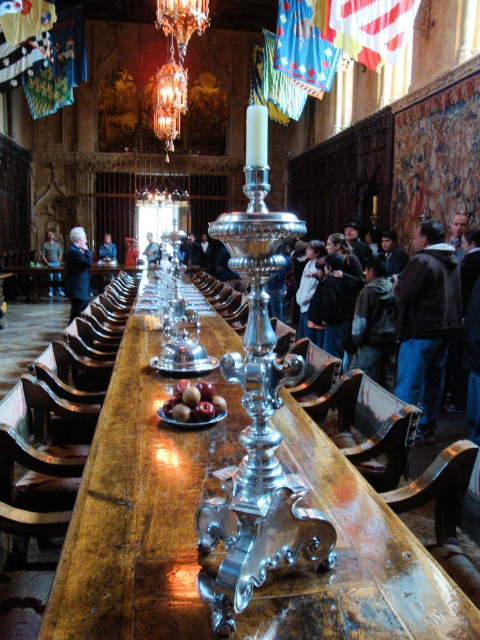
Question: Which object is closer to the camera taking this photo?

Choices:
 (A) brown leather jacket at right
 (B) dark brown leather jacket at center
 (C) orange fabric jacket at center
 (D) blue denim jacket at center

Answer: (A)

Question: Which point is farther from the camera taking this photo?

Choices:
 (A) (81, 227)
 (B) (134, 253)

Answer: (A)

Question: Does matte gray jacket at left appear over blue denim jacket at center?

Choices:
 (A) yes
 (B) no

Answer: (A)

Question: Is light brown leather jacket at center above orange fabric jacket at center?

Choices:
 (A) yes
 (B) no

Answer: (A)

Question: Can you confirm if polished wood table at center is smaller than light brown leather jacket at center?

Choices:
 (A) yes
 (B) no

Answer: (B)

Question: Which object is the closest to the polished wood table at center?

Choices:
 (A) brown leather jacket at right
 (B) dark brown leather jacket at center
 (C) matte gray jacket at left

Answer: (A)